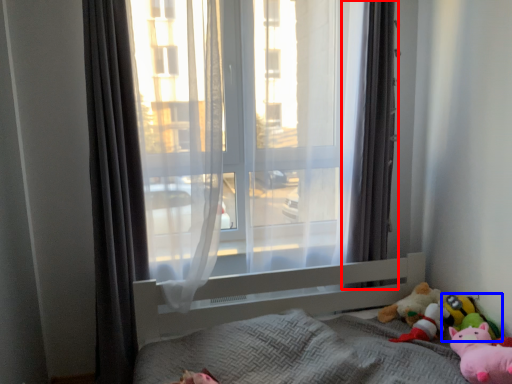
Question: Which of the following is the farthest to the observer, curtain (highlighted by a red box) or toy (highlighted by a blue box)?

Choices:
 (A) curtain
 (B) toy

Answer: (A)